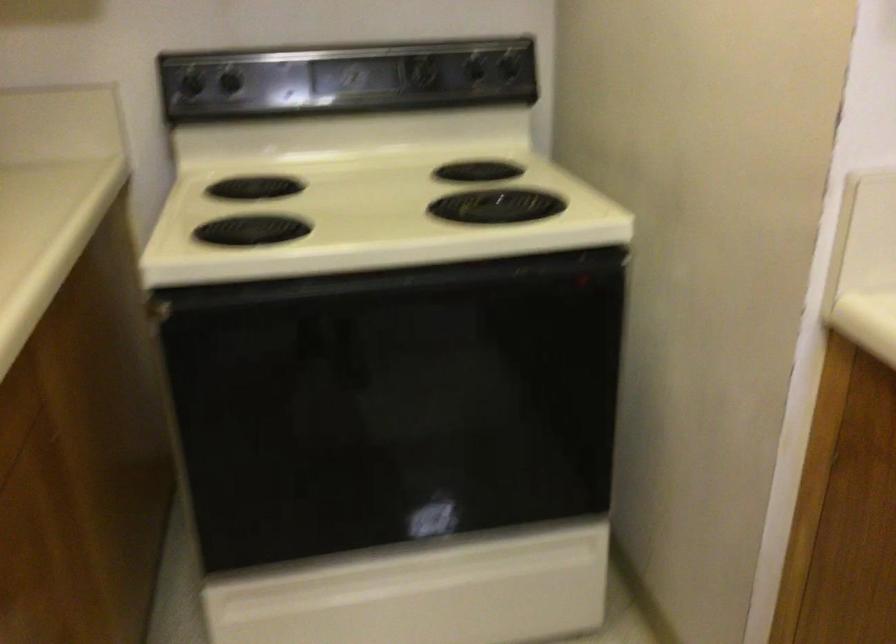
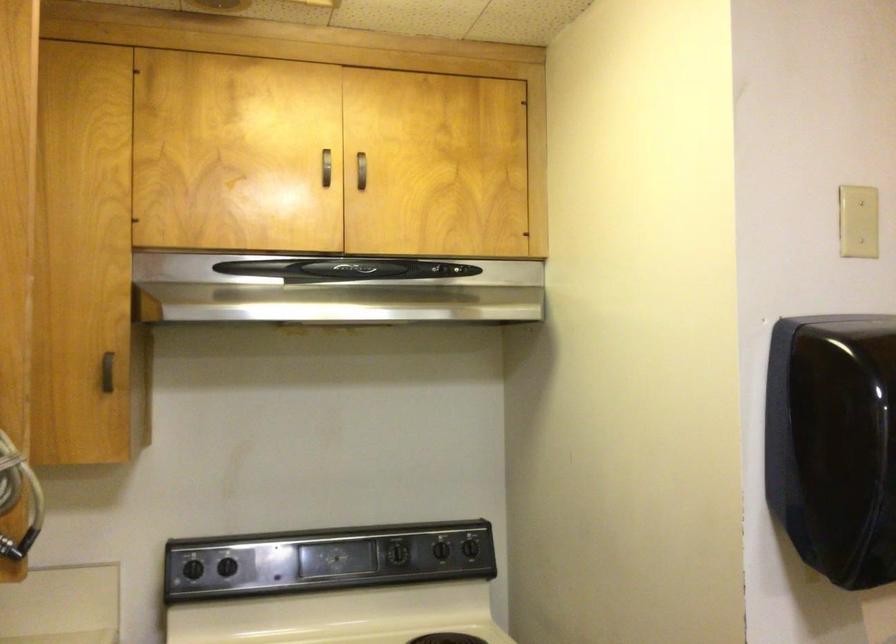
In the second image, find the point that corresponds to (226,84) in the first image.

(227, 567)